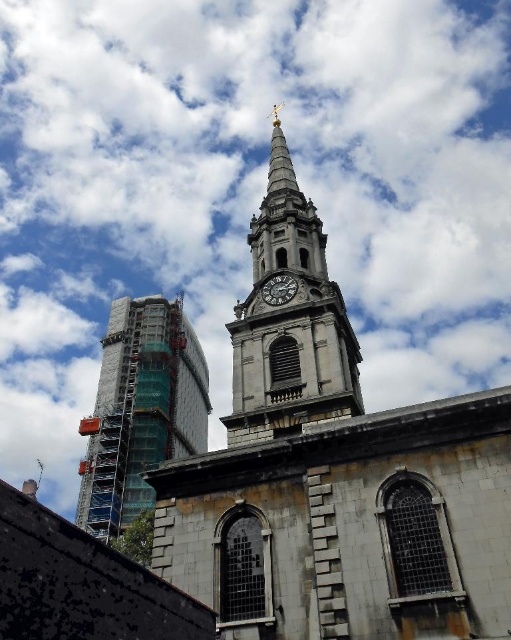
You are standing in a public square and see the stone clock tower at center. If you want to take a photo of it from a distance where it appears small but still recognizable, would 46.52 meters be a suitable distance?

The stone clock tower at center is 46.52 meters away from the viewer, so this distance would make it appear small but still recognizable in the photo.

You are an architect reviewing a cityscape design. You notice the stone clock tower at center and the scaffolding glass at left. Which structure is located higher in the image?

The stone clock tower at center is positioned over scaffolding glass at left, meaning it is higher in the image.

You are an architect evaluating the spatial relationship between the stone clock tower at center and the dark gray stone clock at center in the image. Which structure is taller?

The stone clock tower at center is much taller than the dark gray stone clock at center.